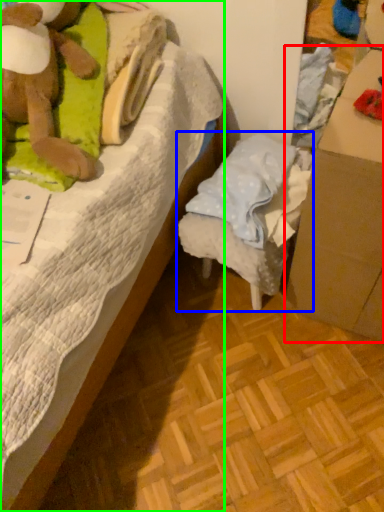
Question: Which is farther away from cardboard box (highlighted by a red box)? furniture (highlighted by a blue box) or bed (highlighted by a green box)?

Choices:
 (A) furniture
 (B) bed

Answer: (B)